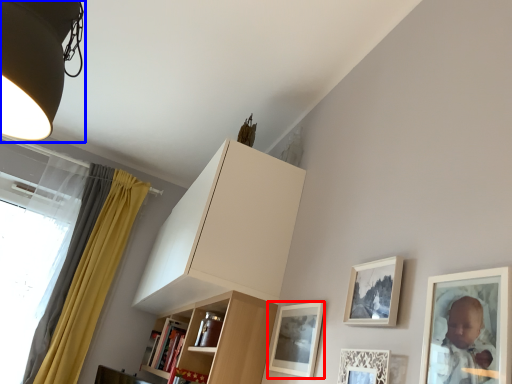
Question: Among these objects, which one is nearest to the camera, picture frame (highlighted by a red box) or lamp (highlighted by a blue box)?

Choices:
 (A) picture frame
 (B) lamp

Answer: (B)